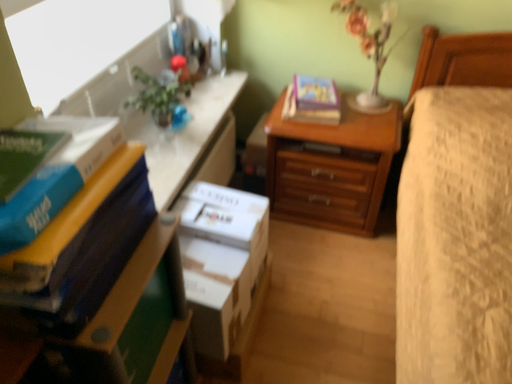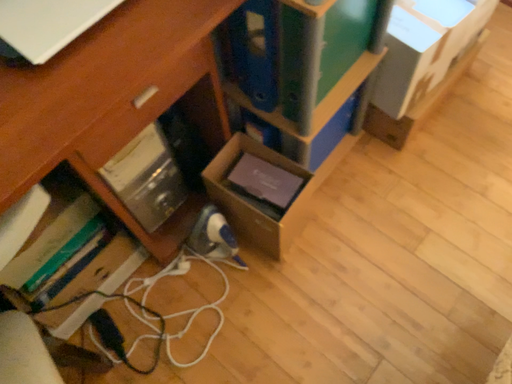
Question: How did the camera likely rotate when shooting the video?

Choices:
 (A) rotated right
 (B) rotated left

Answer: (B)